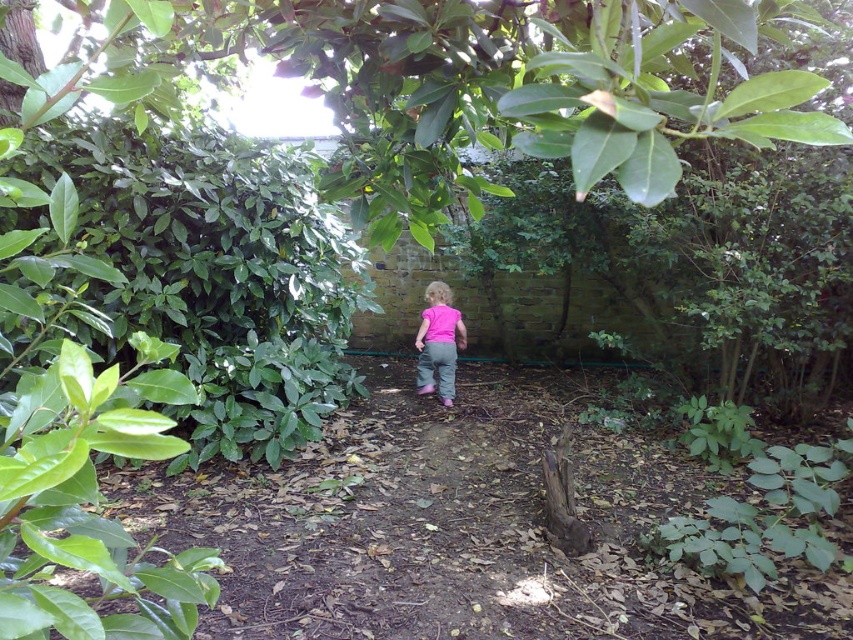
You are observing a child walking towards a brick wall in a garden. There are two points marked in the scene, point (577, 163) and point (442, 392). Which point is closer to the child as they walk forward?

Point (577, 163) is in front of point (442, 392). Since the child is walking towards the brick wall, the point that is in front would be closer to the child as they move forward.

You are a photographer trying to capture a photo of the green leafy tree at upper center. You want to ensure the tree is in focus. Given that your camera has a minimum focusing distance of 25 inches, will you need to adjust your position to take the photo?

The green leafy tree at upper center is 27.44 inches from the camera, which is beyond the minimum focusing distance of 25 inches. Therefore, you do not need to adjust your position to focus on the green leafy tree at upper center.

In the scene shown: You are a photographer trying to capture a closeup of the pink fabric at center without the green leafy tree at upper center blocking the view. Based on their sizes, which object should you adjust your camera angle to focus on first?

The green leafy tree at upper center is larger in size than the pink fabric at center, so you should adjust your camera angle to focus on the pink fabric at center first to avoid obstruction.